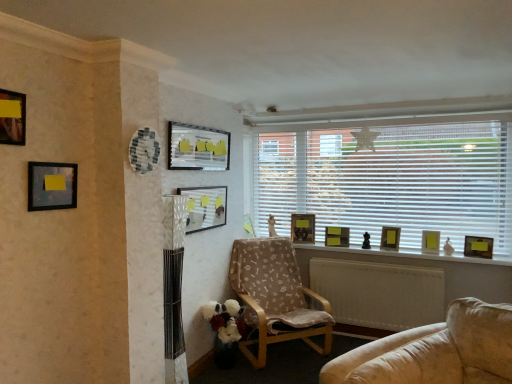
What are the coordinates of `free area in between yellow matte picture frame at right, the 6th picture frame from the front, and yellow matte picture frame at window, acting as the 7th picture frame starting from the front` in the screenshot? It's located at (413, 251).